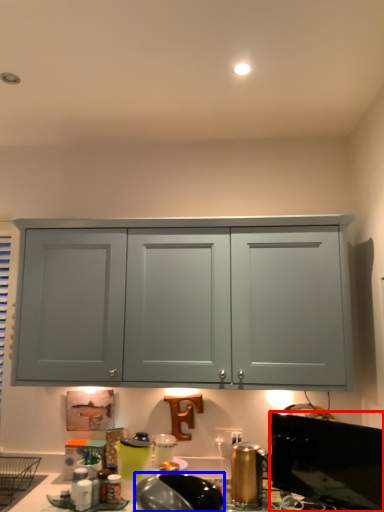
Question: Which object appears closest to the camera in this image, window screen (highlighted by a red box) or appliance (highlighted by a blue box)?

Choices:
 (A) window screen
 (B) appliance

Answer: (B)